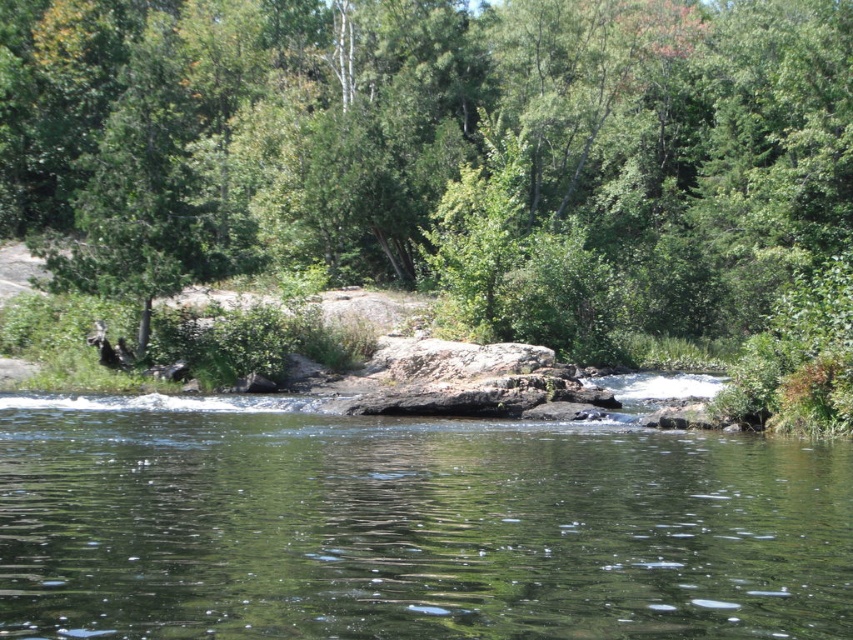
Question: Among these points, which one is farthest from the camera?

Choices:
 (A) (291, 435)
 (B) (525, 44)

Answer: (B)

Question: Can you confirm if green leafy tree at center is smaller than clear water at center?

Choices:
 (A) yes
 (B) no

Answer: (B)

Question: Can you confirm if green leafy tree at center is positioned to the left of clear water at center?

Choices:
 (A) no
 (B) yes

Answer: (B)

Question: Which point is farther from the camera taking this photo?

Choices:
 (A) (223, 480)
 (B) (520, 22)

Answer: (B)

Question: Can you confirm if green leafy tree at center is positioned below clear water at center?

Choices:
 (A) no
 (B) yes

Answer: (A)